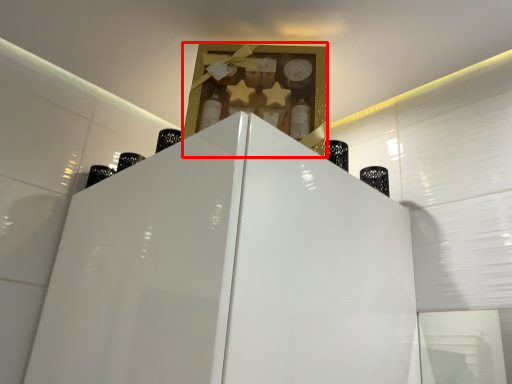
Question: From the image's perspective, what is the correct spatial relationship of cabinet (annotated by the red box) in relation to bottle?

Choices:
 (A) below
 (B) above

Answer: (B)